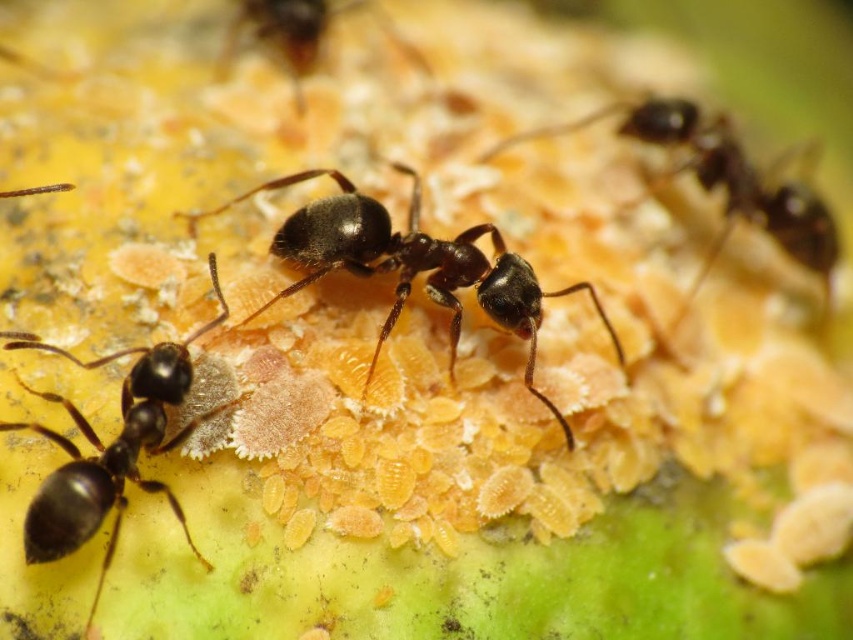
Question: Based on their relative distances, which object is farther from the black glossy ant at lower left?

Choices:
 (A) black glossy ant at center
 (B) shiny black ant at center

Answer: (A)

Question: Based on their relative distances, which object is nearer to the black glossy ant at center?

Choices:
 (A) shiny black ant at center
 (B) black glossy ant at lower left
 (C) shiny brown ant at upper center

Answer: (A)

Question: Which object is positioned farthest from the shiny brown ant at upper center?

Choices:
 (A) black glossy ant at lower left
 (B) black glossy ant at center

Answer: (A)

Question: From the image, what is the correct spatial relationship of shiny black ant at center in relation to black glossy ant at center?

Choices:
 (A) right
 (B) left

Answer: (B)

Question: Is shiny black ant at center in front of shiny brown ant at upper center?

Choices:
 (A) no
 (B) yes

Answer: (B)

Question: Can you confirm if black glossy ant at lower left is thinner than black glossy ant at center?

Choices:
 (A) yes
 (B) no

Answer: (A)